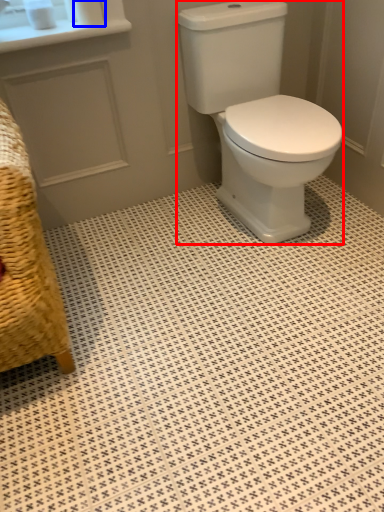
Question: Which object appears farthest to the camera in this image, porcelain (highlighted by a red box) or toilet paper (highlighted by a blue box)?

Choices:
 (A) porcelain
 (B) toilet paper

Answer: (B)